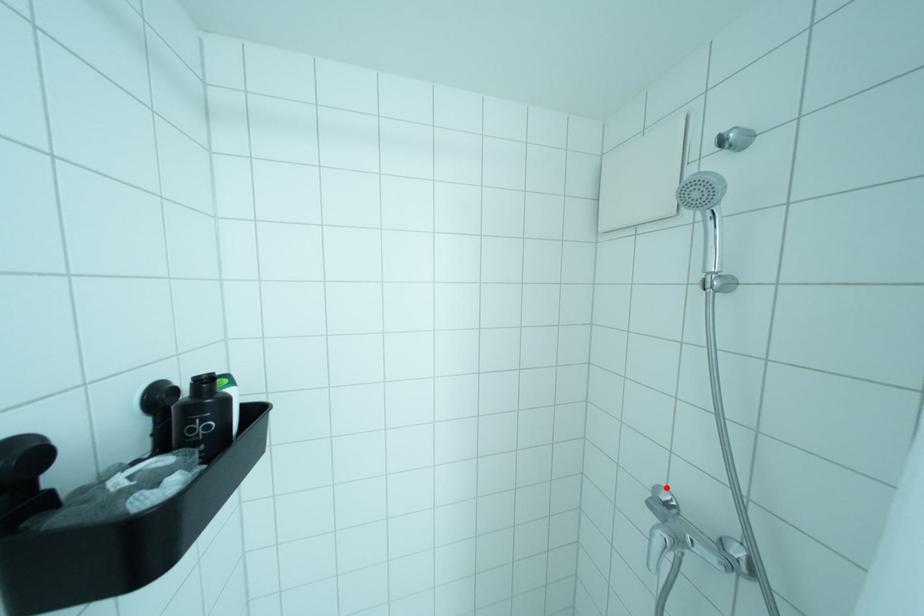
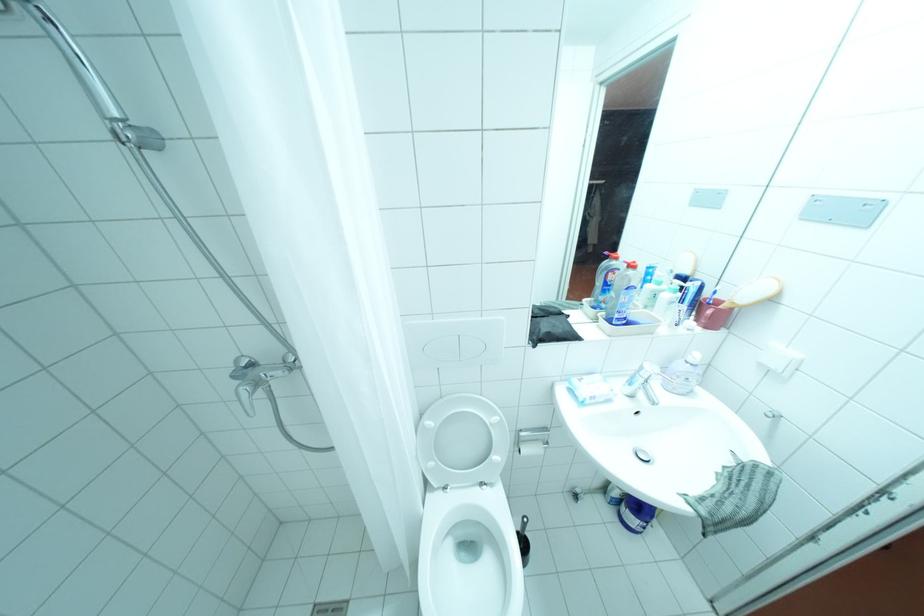
Where in the second image is the point corresponding to the highlighted location from the first image?

(246, 360)